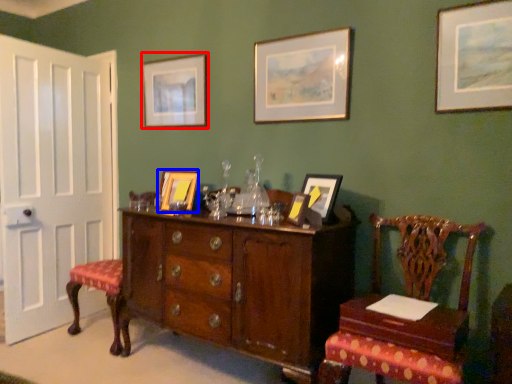
Question: Which object is closer to the camera taking this photo, picture frame (highlighted by a red box) or picture frame (highlighted by a blue box)?

Choices:
 (A) picture frame
 (B) picture frame

Answer: (B)